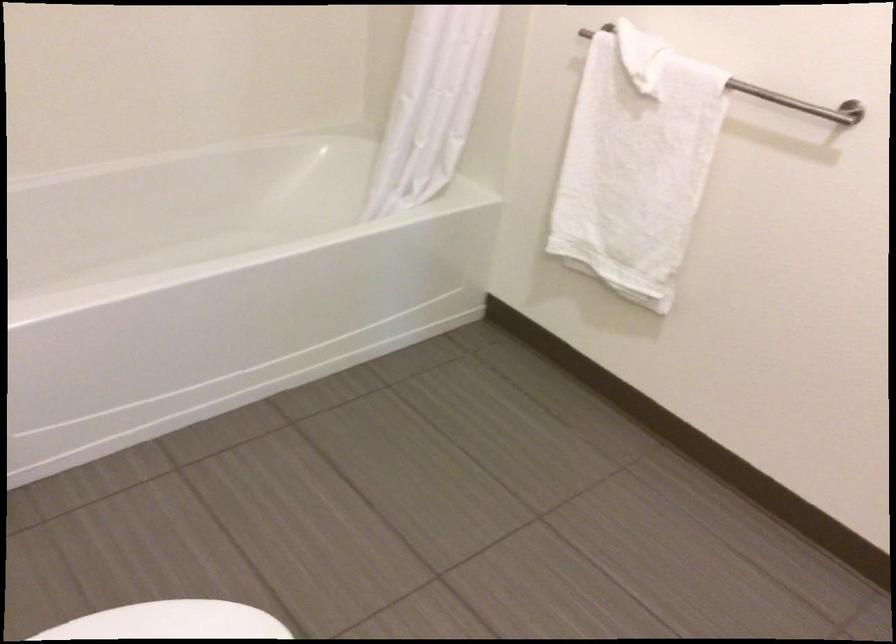
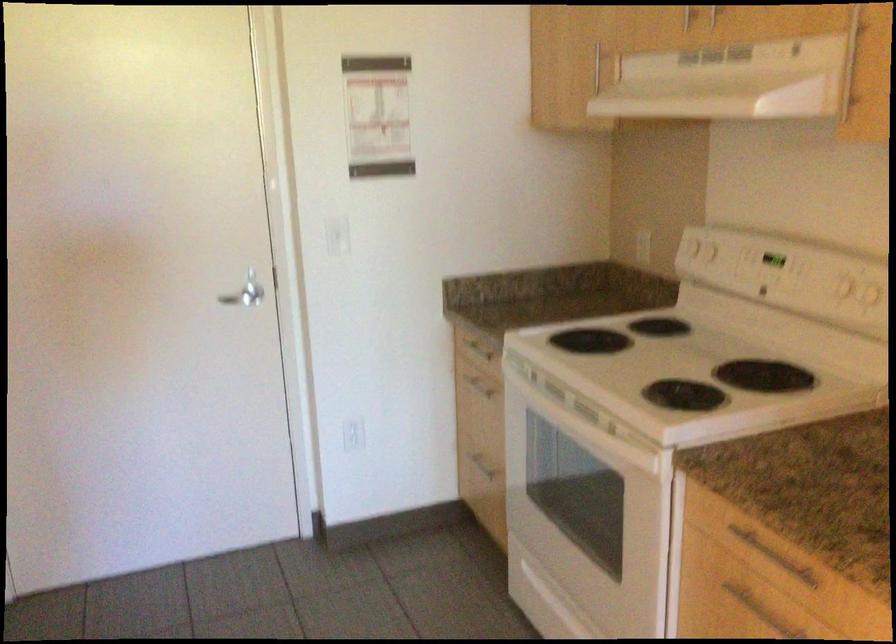
The images are taken continuously from a first-person perspective. In which direction are you moving?

The cameraman moved toward right, forward.